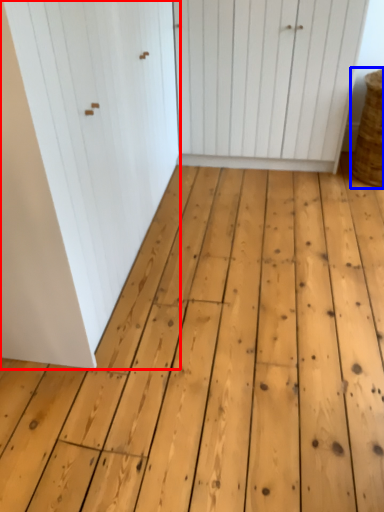
Question: Among these objects, which one is farthest to the camera, door (highlighted by a red box) or basket (highlighted by a blue box)?

Choices:
 (A) door
 (B) basket

Answer: (B)